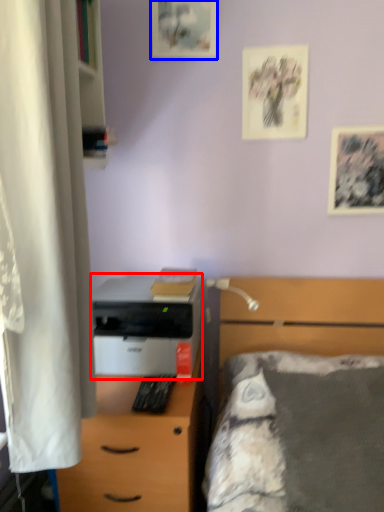
Question: Which point is closer to the camera, printer (highlighted by a red box) or picture frame (highlighted by a blue box)?

Choices:
 (A) printer
 (B) picture frame

Answer: (A)